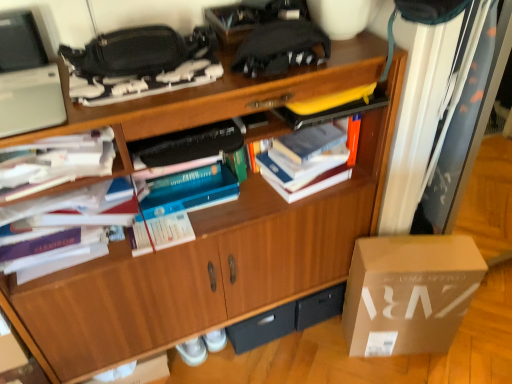
Question: Is white cardboard box at lower right bigger than black plastic drawer at lower center?

Choices:
 (A) yes
 (B) no

Answer: (A)

Question: Is white cardboard box at lower right located outside black plastic drawer at lower center?

Choices:
 (A) yes
 (B) no

Answer: (A)

Question: Does white cardboard box at lower right have a greater height compared to black plastic drawer at lower center?

Choices:
 (A) yes
 (B) no

Answer: (A)

Question: Is white cardboard box at lower right positioned in front of black plastic drawer at lower center?

Choices:
 (A) no
 (B) yes

Answer: (B)

Question: Is white cardboard box at lower right thinner than black plastic drawer at lower center?

Choices:
 (A) yes
 (B) no

Answer: (B)

Question: Considering their positions, is white cardboard box at lower right located in front of or behind silver matte laptop at upper left?

Choices:
 (A) behind
 (B) front

Answer: (A)

Question: Is white cardboard box at lower right wider or thinner than silver matte laptop at upper left?

Choices:
 (A) wide
 (B) thin

Answer: (B)

Question: From a real-world perspective, is white cardboard box at lower right physically located above or below silver matte laptop at upper left?

Choices:
 (A) below
 (B) above

Answer: (A)

Question: Is white cardboard box at lower right bigger or smaller than silver matte laptop at upper left?

Choices:
 (A) small
 (B) big

Answer: (B)

Question: From the image's perspective, is white paper at upper left, marked as the second book in a right-to-left arrangement, above or below black fabric handbag at upper center?

Choices:
 (A) above
 (B) below

Answer: (B)

Question: Is point pos(100,135) positioned closer to the camera than point pos(145,41)?

Choices:
 (A) closer
 (B) farther

Answer: (A)

Question: Looking at the image, does white paper at upper left, marked as the second book in a right-to-left arrangement, seem bigger or smaller compared to black fabric handbag at upper center?

Choices:
 (A) big
 (B) small

Answer: (A)

Question: From a real-world perspective, is white paper at upper left, marked as the second book in a right-to-left arrangement, above or below black fabric handbag at upper center?

Choices:
 (A) below
 (B) above

Answer: (A)

Question: From the image's perspective, relative to black fabric handbag at upper center, is silver matte laptop at upper left above or below?

Choices:
 (A) below
 (B) above

Answer: (A)

Question: From their relative heights in the image, would you say silver matte laptop at upper left is taller or shorter than black fabric handbag at upper center?

Choices:
 (A) short
 (B) tall

Answer: (A)